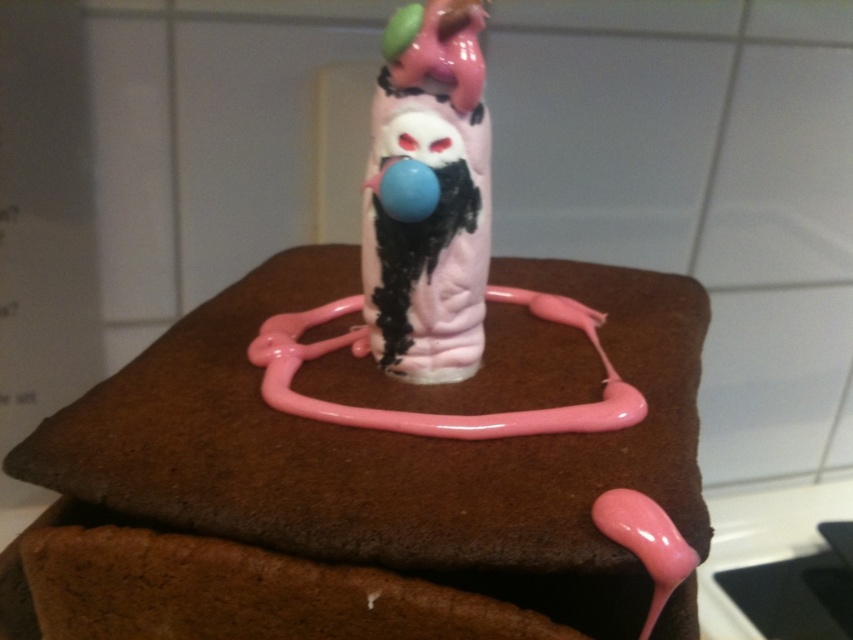
Measure the distance from matte plastic toy at center to matte pink plastic figurine at center.

matte plastic toy at center is 1.17 inches from matte pink plastic figurine at center.

Is point (412, 205) farther from viewer compared to point (444, 138)?

No, (412, 205) is in front of (444, 138).

Who is more forward, (325, 403) or (393, 320)?

Positioned in front is point (325, 403).

I want to click on matte plastic toy at center, so click(x=431, y=250).